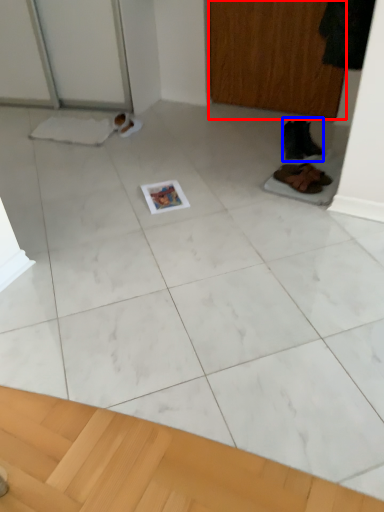
Question: Among these objects, which one is nearest to the camera, screen door (highlighted by a red box) or footwear (highlighted by a blue box)?

Choices:
 (A) screen door
 (B) footwear

Answer: (B)